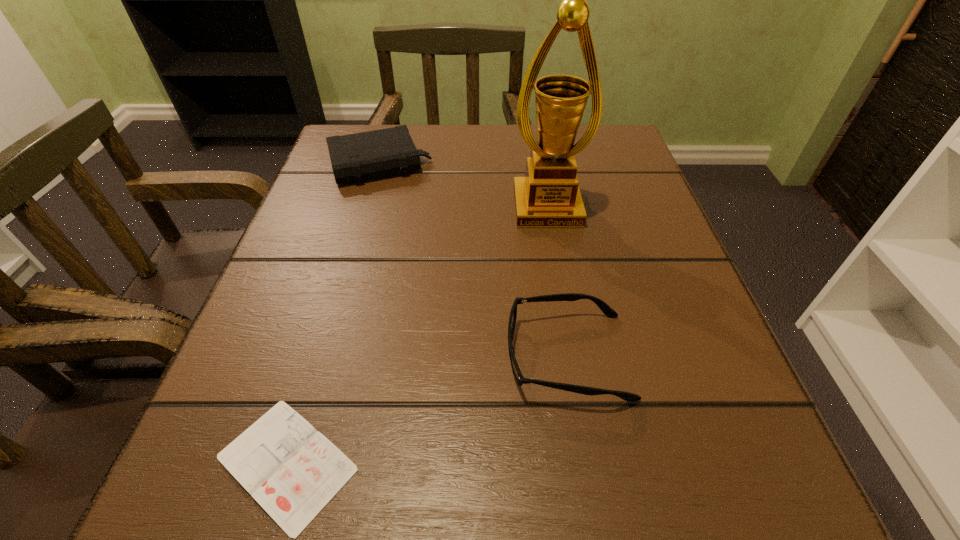
The width and height of the screenshot is (960, 540). I want to click on the tallest object, so click(x=549, y=196).

Identify the location of Bible. This screenshot has height=540, width=960. (355, 157).

You are a GUI agent. You are given a task and a screenshot of the screen. Output one action in this format:
    pyautogui.click(x=<x>, y=<y>)
    Task: Click on the spectacles
    This screenshot has height=540, width=960.
    Given the screenshot: What is the action you would take?
    pyautogui.click(x=606, y=309)

The image size is (960, 540). I want to click on diary, so click(x=293, y=471).

Where is `vacant space located 0.380m on the front-facing side of the tallest object`? vacant space located 0.380m on the front-facing side of the tallest object is located at coordinates (587, 434).

Identify the location of free space located on the front of the Bible. This screenshot has width=960, height=540. (326, 343).

Locate an element on the screen. The height and width of the screenshot is (540, 960). free space located 0.180m on the front-facing side of the spectacles is located at coordinates (374, 356).

Image resolution: width=960 pixels, height=540 pixels. I want to click on free location located 0.360m on the front-facing side of the spectacles, so click(241, 356).

This screenshot has width=960, height=540. Identify the location of free spot located 0.100m on the front-facing side of the spectacles. (433, 356).

Locate an element on the screen. The image size is (960, 540). free space located on the right of the diary is located at coordinates (527, 463).